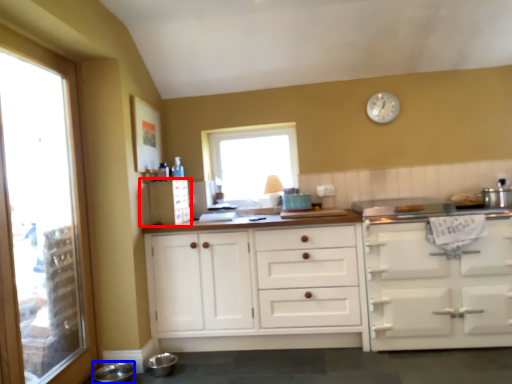
Question: Which object is closer to the camera taking this photo, appliance (highlighted by a red box) or appliance (highlighted by a blue box)?

Choices:
 (A) appliance
 (B) appliance

Answer: (B)